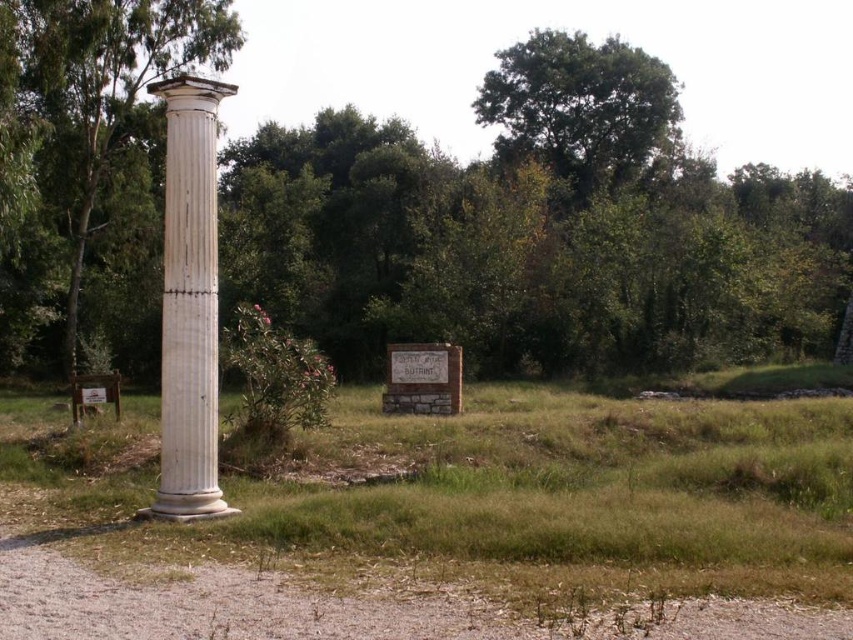
In the scene shown: You are an archaeologist examining the scene. You need to determine which object is nearer to you between the white marble column at center and the green leafy tree at upper center. Based on the spatial arrangement, which one is closer?

The white marble column at center is closer to the viewer than the green leafy tree at upper center.